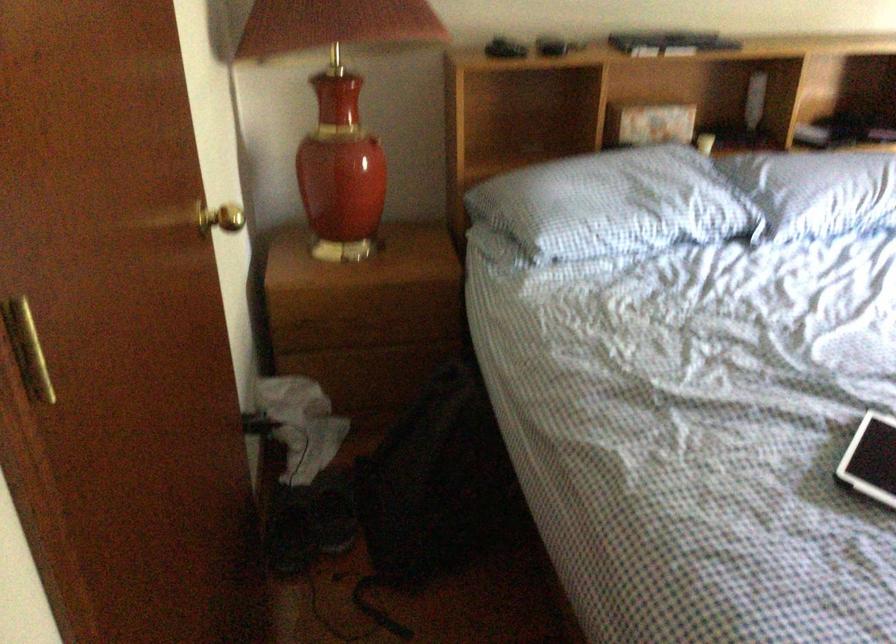
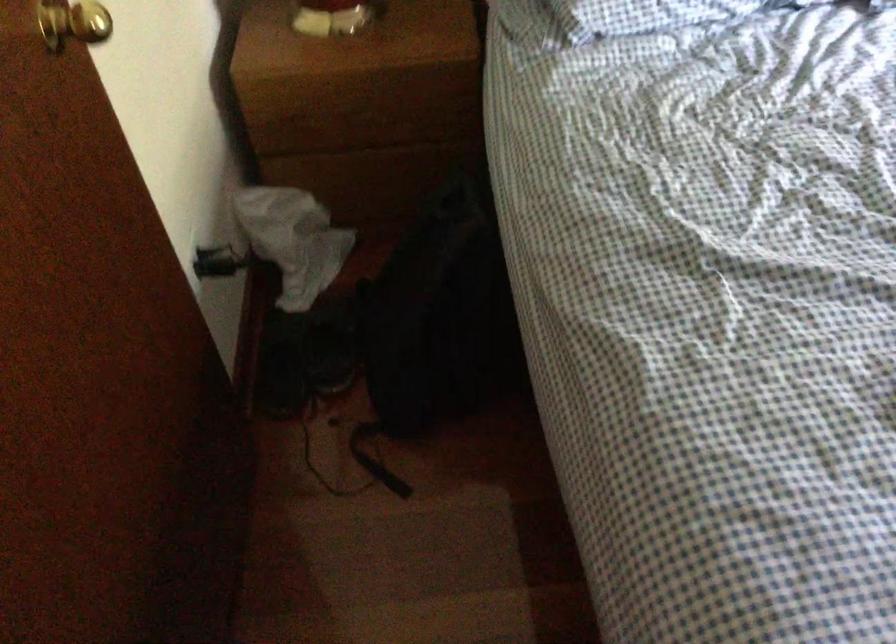
Locate, in the second image, the point that corresponds to (x=334, y=513) in the first image.

(332, 345)